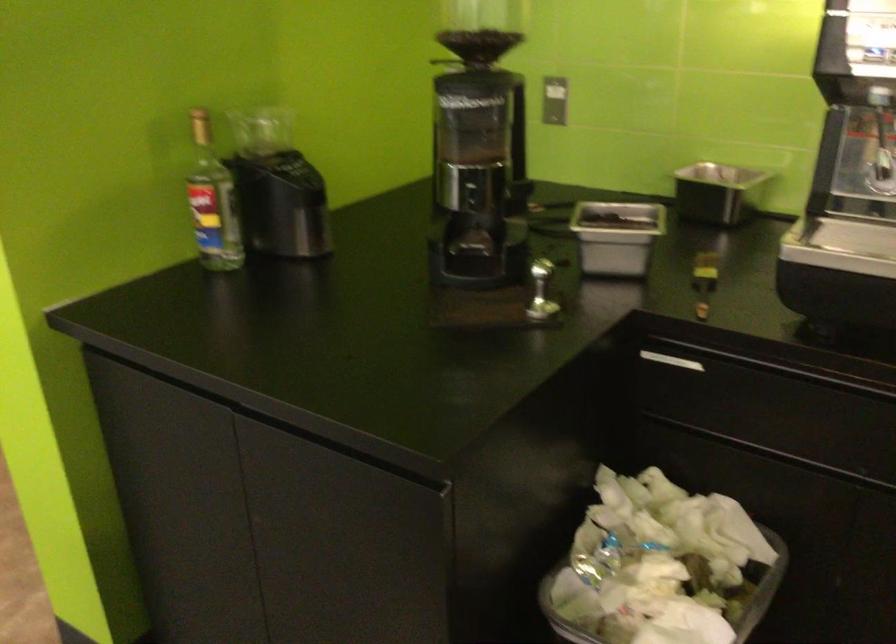
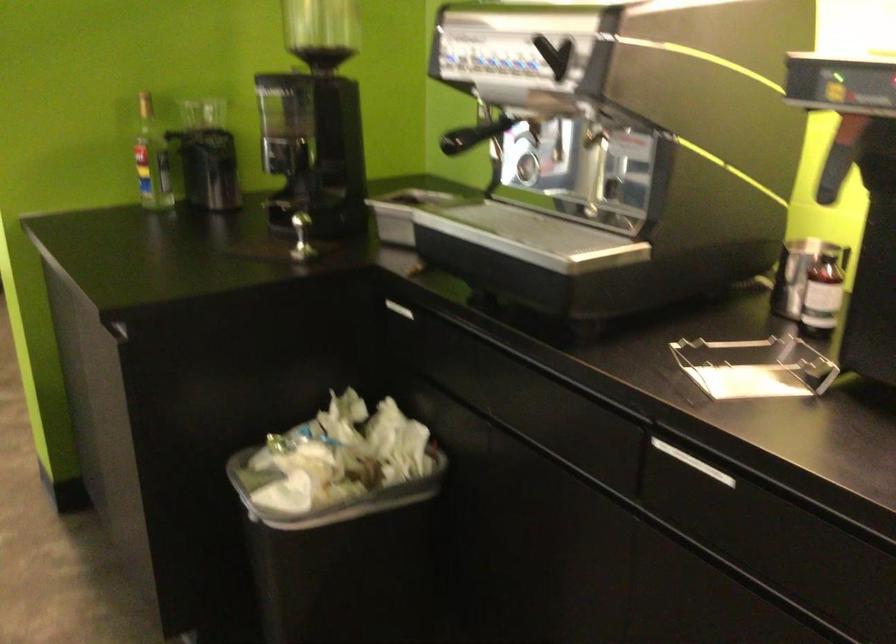
Locate, in the second image, the point that corresponds to [657,357] in the first image.

(394, 308)